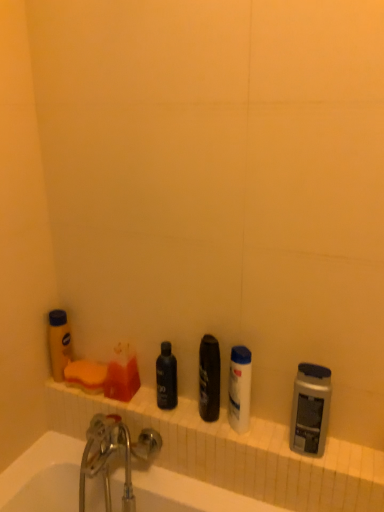
Where is `free location to the left of black matte bottle at center, which is the third toiletry in left-to-right order`? The image size is (384, 512). free location to the left of black matte bottle at center, which is the third toiletry in left-to-right order is located at coordinates (134, 403).